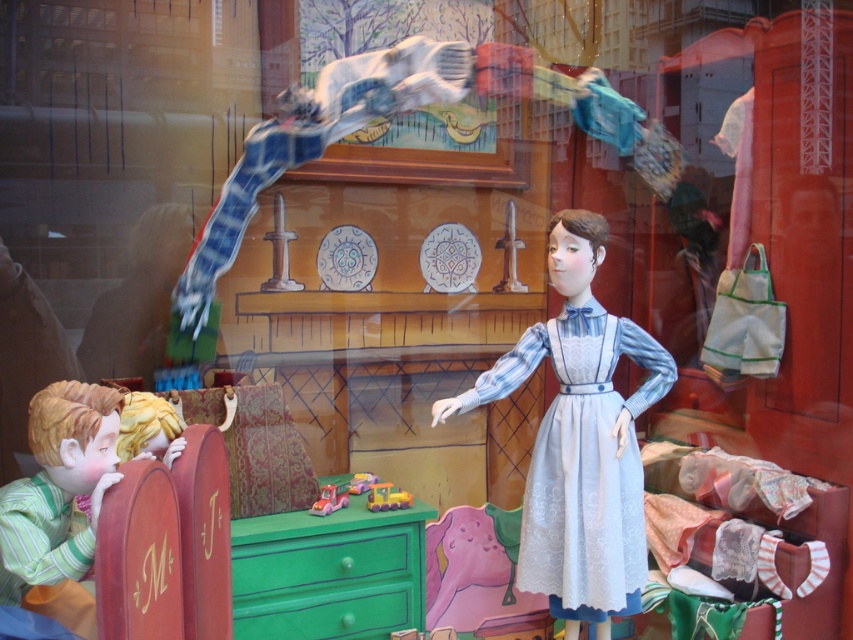
You are a customer looking at the window display. You notice the green striped fabric at left and the plastic toy truck at center. Which object is closer to you?

The green striped fabric at left is closer to you because it is in front of the plastic toy truck at center.

You are a delivery person who needs to place a large box that is 1.5 meters long in the space between the green striped fabric at left and the yellow rubber toy car at center. Is there enough space?

The space between the green striped fabric at left and the yellow rubber toy car at center is 1.20 meters, which is shorter than the box length of 1.5 meters. Therefore, the box cannot fit in that space.

You are a child trying to fit both the pastel plastic toy car at center and the yellow rubber toy car at center into a rectangular box. The box can only accommodate items up to the width of the wider car. Which car determines the minimum required width of the box?

The pastel plastic toy car at center determines the minimum required width of the box because its width surpasses that of the yellow rubber toy car at center.